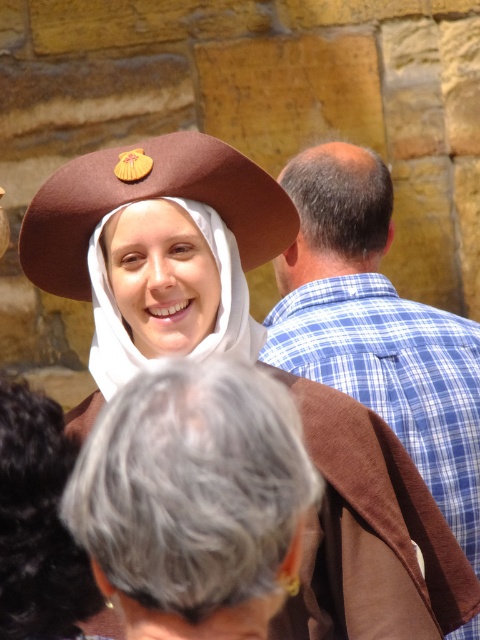
Does point (298, 280) come in front of point (211, 232)?

No, (298, 280) is further to viewer.

Can you confirm if blue plaid shirt at right is thinner than brown felt hat at center?

No.

Where is `blue plaid shirt at right`? The width and height of the screenshot is (480, 640). blue plaid shirt at right is located at coordinates (376, 326).

Between blue plaid shirt at right and brown felt hat at upper center, which one appears on the left side from the viewer's perspective?

Positioned to the left is brown felt hat at upper center.

Who is more distant from viewer, [456,486] or [62,230]?

Point [456,486]

Find the location of a particular element. The width and height of the screenshot is (480, 640). blue plaid shirt at right is located at coordinates (x=376, y=326).

Can you confirm if brown felt hat at upper center is taller than brown felt hat at center?

No.

Which is more to the right, brown felt hat at upper center or brown felt hat at center?

brown felt hat at upper center is more to the right.

Is point (103, 148) positioned before point (222, 224)?

No, it is not.

Find the location of a particular element. Image resolution: width=480 pixels, height=640 pixels. brown felt hat at upper center is located at coordinates (146, 198).